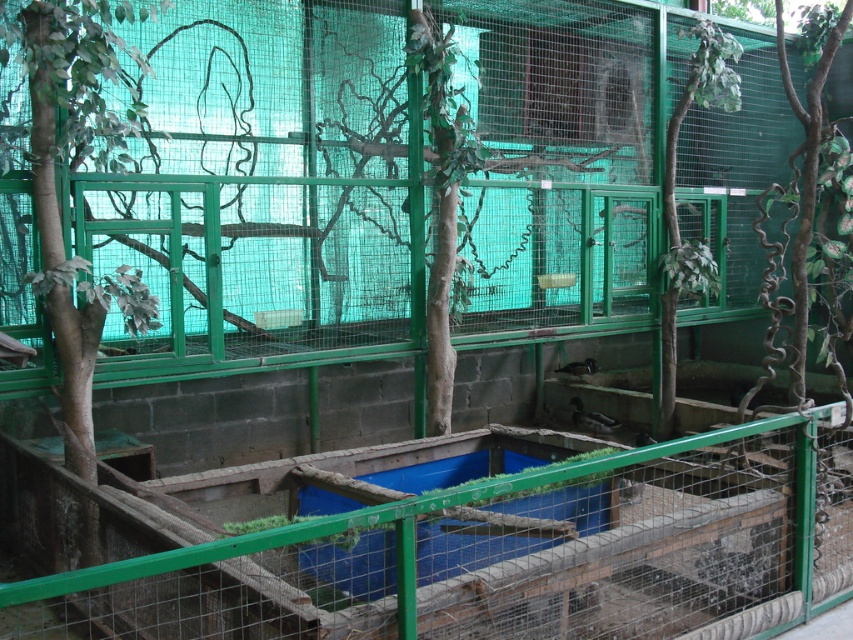
You are a zookeeper observing the green wire mesh at lower center and the brown matte bird at lower center in the enclosure. Which object is wider?

The green wire mesh at lower center is wider than the brown matte bird at lower center.

In the scene shown: You are a zookeeper observing the bird enclosure. You notice the green wire mesh at lower center and the brown matte bird at lower center. Based on their positions, which object is closer to the left side of the enclosure?

The green wire mesh at lower center is closer to the left side of the enclosure because it is positioned to the left of the brown matte bird at lower center.